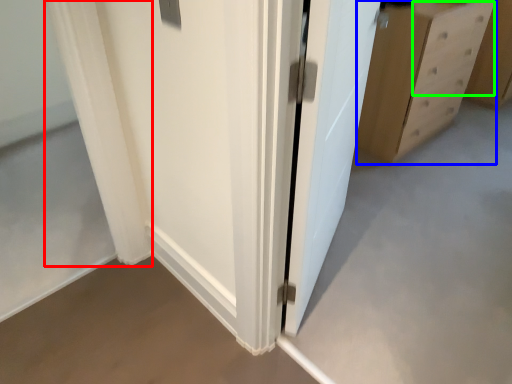
Question: Considering the real-world distances, which object is farthest from curtain (highlighted by a red box)? chest of drawers (highlighted by a blue box) or drawer (highlighted by a green box)?

Choices:
 (A) chest of drawers
 (B) drawer

Answer: (B)